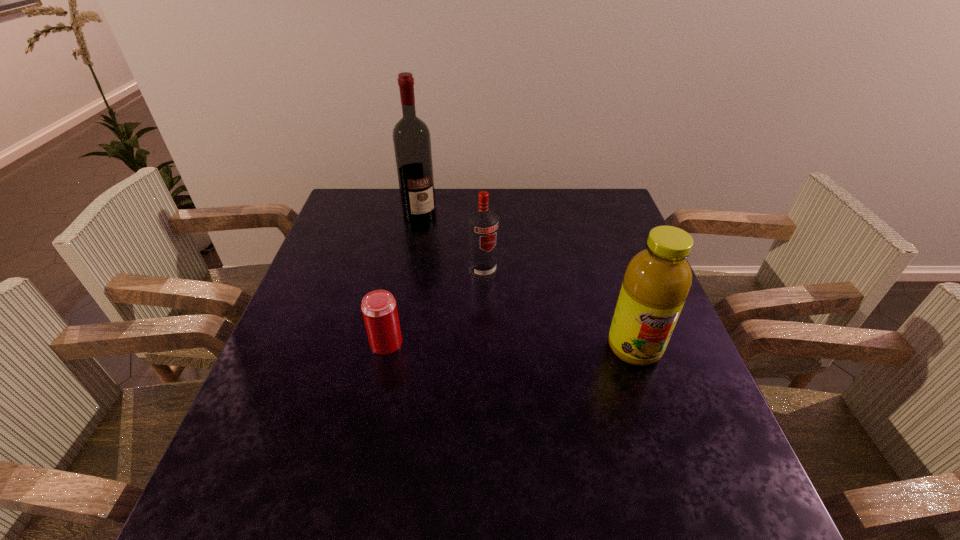
This screenshot has width=960, height=540. I want to click on free space located 0.210m on the front label of the vodka, so click(x=524, y=336).

Where is `vacant space located 0.100m on the front label of the vodka`? Image resolution: width=960 pixels, height=540 pixels. vacant space located 0.100m on the front label of the vodka is located at coordinates (504, 306).

This screenshot has height=540, width=960. I want to click on vacant space located 0.060m on the front and back of the tallest object, so click(433, 233).

The width and height of the screenshot is (960, 540). In order to click on vacant space located on the front and back of the tallest object in this screenshot , I will do `click(452, 261)`.

Where is `blank space located on the front and back of the tallest object`? This screenshot has height=540, width=960. blank space located on the front and back of the tallest object is located at coordinates (443, 247).

This screenshot has height=540, width=960. I want to click on object that is at the far edge, so click(412, 144).

Identify the location of object that is at the right edge. The height and width of the screenshot is (540, 960). (657, 280).

Identify the location of vacant area at the far edge of the desktop. Image resolution: width=960 pixels, height=540 pixels. (458, 195).

Image resolution: width=960 pixels, height=540 pixels. Find the location of `free space at the near edge of the desktop`. free space at the near edge of the desktop is located at coordinates (539, 428).

Where is `free region at the left edge of the desktop`? This screenshot has width=960, height=540. free region at the left edge of the desktop is located at coordinates (272, 375).